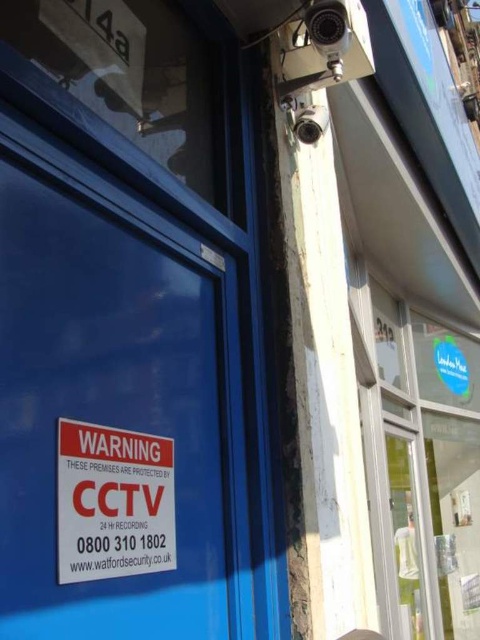
You are standing in front of a store with a blue door and a window. You see a blue matte sign at center. If you want to read the sign clearly, should you move closer or farther away?

The blue matte sign at center is 29.19 inches away from the viewer. To read it clearly, you should move closer since the sign is at a distance.

You are a delivery person approaching the blue door. You notice two signs on the door. The first is a blue matte sign at center and the second is a white paper sign at center. Which one is positioned to the right side of the other?

The blue matte sign at center is to the right of white paper sign at center, so the blue matte sign at center is positioned to the right side of the white paper sign at center.

In the scene shown: You are a delivery person approaching the storefront and need to read both the blue matte sign at center and the white paper sign at center. Which sign will you be able to read more clearly from a distance?

The blue matte sign at center is larger in size than the white paper sign at center, so it will be easier to read from a distance.